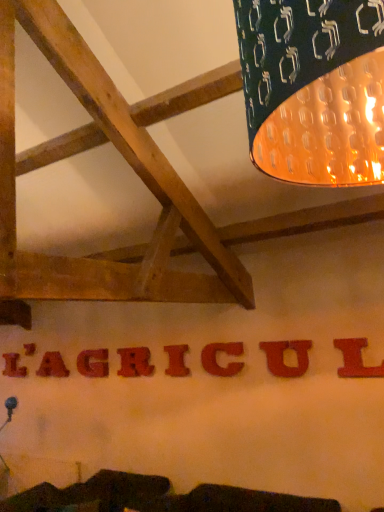
Question: Is matte red letter g at center, the fourth letter from the left, closer to the viewer compared to matte red letter at center, which is the seventh letter in left-to-right order?

Choices:
 (A) no
 (B) yes

Answer: (A)

Question: Considering the relative sizes of matte red letter g at center, the fourth letter from the left, and matte red letter at center, which is the seventh letter in left-to-right order, in the image provided, is matte red letter g at center, the fourth letter from the left, shorter than matte red letter at center, which is the seventh letter in left-to-right order,?

Choices:
 (A) yes
 (B) no

Answer: (B)

Question: From the image's perspective, is matte red letter g at center, the fourth letter from the left, on top of matte red letter at center, which is the seventh letter in left-to-right order?

Choices:
 (A) no
 (B) yes

Answer: (A)

Question: Is there a large distance between matte red letter g at center, placed as the sixth letter when sorted from right to left, and matte red letter at center, arranged as the 7th letter when viewed from the back?

Choices:
 (A) no
 (B) yes

Answer: (B)

Question: From a real-world perspective, is matte red letter g at center, the fourth letter from the left, located beneath matte red letter at center, arranged as the 7th letter when viewed from the back?

Choices:
 (A) yes
 (B) no

Answer: (B)

Question: Is matte red letter at center, the fifth letter in the left-to-right sequence, wider or thinner than matte red letter u at center, positioned as the 8th letter in left-to-right order?

Choices:
 (A) wide
 (B) thin

Answer: (A)

Question: Choose the correct answer: Is matte red letter at center, arranged as the 5th letter when viewed from the front, inside matte red letter u at center, which ranks as the second letter in front-to-back order, or outside it?

Choices:
 (A) inside
 (B) outside

Answer: (B)

Question: From the image's perspective, is matte red letter at center, arranged as the 5th letter when viewed from the front, positioned above or below matte red letter u at center, which ranks as the second letter in front-to-back order?

Choices:
 (A) above
 (B) below

Answer: (B)

Question: Based on their positions, is matte red letter at center, marked as the 5th letter in a back-to-front arrangement, located to the left or right of matte red letter u at center, positioned as the 8th letter in left-to-right order?

Choices:
 (A) left
 (B) right

Answer: (A)

Question: Considering the positions of point (281, 352) and point (362, 337), is point (281, 352) closer or farther from the camera than point (362, 337)?

Choices:
 (A) farther
 (B) closer

Answer: (A)

Question: Looking at the image, does matte red letter u at center, which is the 2th letter from right to left, seem bigger or smaller compared to red matte letter l at center, placed as the 1th letter when sorted from right to left?

Choices:
 (A) small
 (B) big

Answer: (A)

Question: Choose the correct answer: Is matte red letter u at center, which is the 2th letter from right to left, inside red matte letter l at center, the ninth letter from the left, or outside it?

Choices:
 (A) outside
 (B) inside

Answer: (A)

Question: Looking at their shapes, would you say matte red letter u at center, which ranks as the second letter in front-to-back order, is wider or thinner than red matte letter l at center, acting as the 1th letter starting from the front?

Choices:
 (A) thin
 (B) wide

Answer: (A)

Question: Considering their positions, is matte red letter u at center, which ranks as the second letter in front-to-back order, located in front of or behind matte red letter at center, arranged as the 7th letter when viewed from the back?

Choices:
 (A) behind
 (B) front

Answer: (B)

Question: From a real-world perspective, is matte red letter u at center, which ranks as the second letter in front-to-back order, above or below matte red letter at center, the 3th letter when ordered from front to back?

Choices:
 (A) above
 (B) below

Answer: (A)